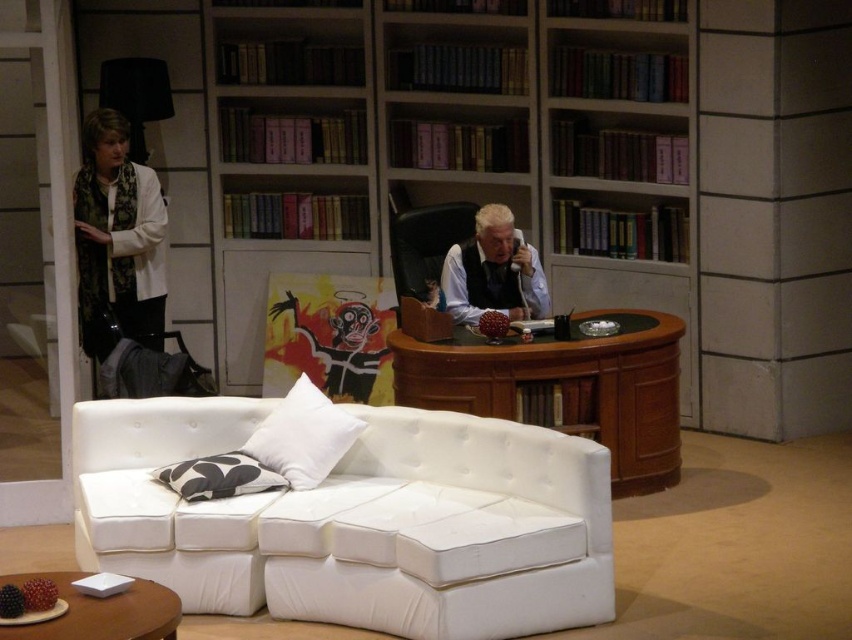
You are an actor in a play and need to move from the white leather couch at lower center to the wooden desk at center during a scene. Which direction should you move to reach the desk?

The white leather couch at lower center is located below the wooden desk at center, so you should move upward to reach the desk.

You are an actor positioned at the point labeled point (275, 570) in the scene. Your next line requires you to move toward the point labeled point (565, 353). Based on the stage setup, will you need to move forward or backward to reach your next position?

Since point (275, 570) is in front of point (565, 353), you will need to move backward to reach the next position.